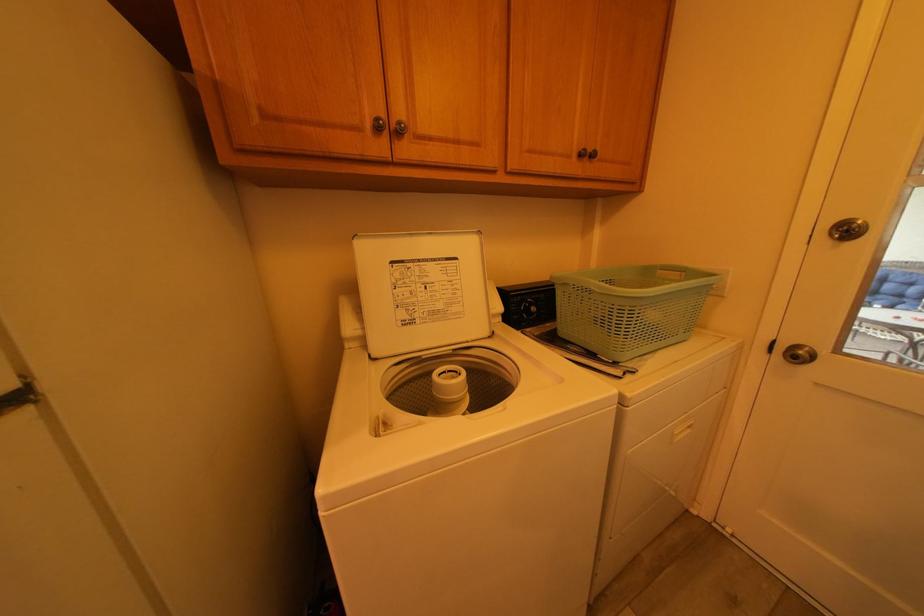
Where would you clos the white washing machine lid? Please return your answer as a coordinate pair (x, y).

(420, 290)